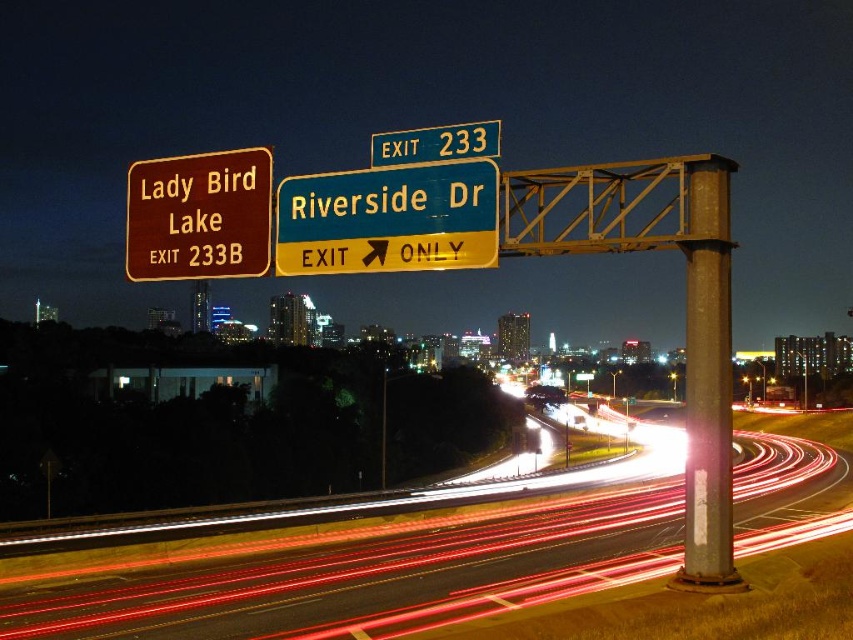
You are a self driving car navigating the highway exit. You see two points marked on the road ahead. The first point is at coordinates point (340,204) and the second is at point (490,120). Based on the scene, which point is closer to your current position?

Point (340,204) is in front of point (490,120), so the first point is closer to your current position.

You are a driver approaching the highway exit and need to determine the distance between two points on the road signs. The points are labeled as point 1 at coordinates point (714, 328) and point 2 at coordinates point (405, 154). Since you can only see the signs from your current position, which point would appear nearer to you?

Point (714, 328) is closer to the viewer than point (405, 154), so point 1 would appear nearer to you.